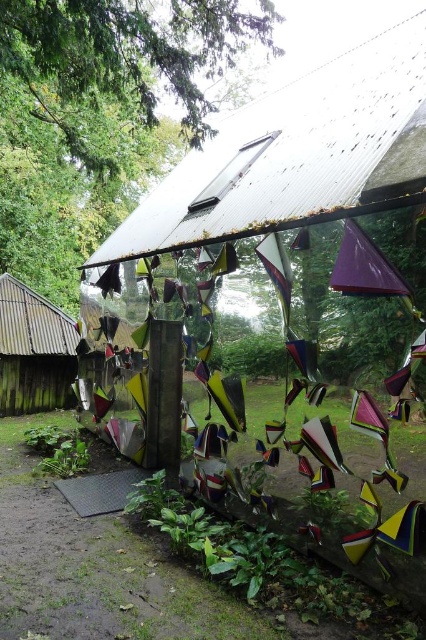
You are standing in front of the wooden shingles hut at left and want to see the view behind it. Can you see the green leafy tree at upper left from your current position?

The green leafy tree at upper left is in front of the wooden shingles hut at left, so you cannot see the green leafy tree at upper left from your current position behind the wooden shingles hut at left.

You are standing at the center of the outdoor structure with the glass walls and colorful flags. Looking towards the green leafy tree at upper left, can you determine its position relative to your viewpoint?

The green leafy tree at upper left is located at point coordinates approximately 0.181 along the horizontal axis and 0.232 along the vertical axis relative to your viewpoint.

You are standing at the entrance of the wooden shingles hut at left and want to see the green leafy tree at upper left. Can you see it without moving your head?

The green leafy tree at upper left is positioned over the wooden shingles hut at left, so you can see it without moving your head.